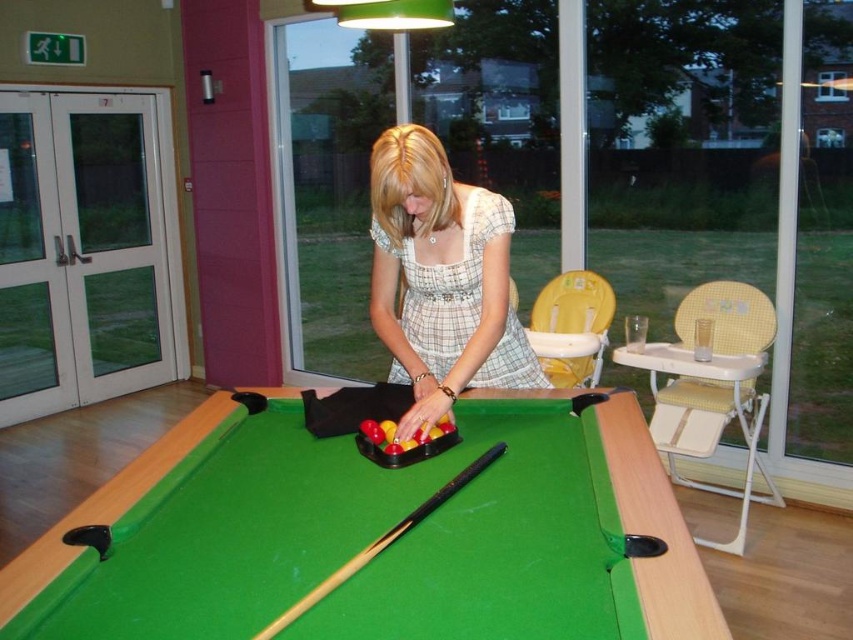
You are a photographer standing in the room and want to take a picture of the white checkered dress at center and the wooden smooth cue at center. Which object should you focus on first if you want to capture the one closer to you?

The wooden smooth cue at center is closer to you than the white checkered dress at center, so you should focus on the wooden smooth cue at center first.

Based on the photo, you are a pool player who wants to hit the cue ball using the wooden smooth cue at center. However, you notice the green felt billiard table at center is blocking your access to the cue. Can you still reach the cue to strike the ball?

The green felt billiard table at center is positioned over the wooden smooth cue at center, so the cue is underneath the table and cannot be reached to strike the ball.

You are a photographer standing in the room and want to capture a shot of the green felt billiard table at center and the white checkered dress at center. Which object is closer to the camera based on their heights?

The green felt billiard table at center is shorter than the white checkered dress at center, so the dress is taller and likely closer to the camera.